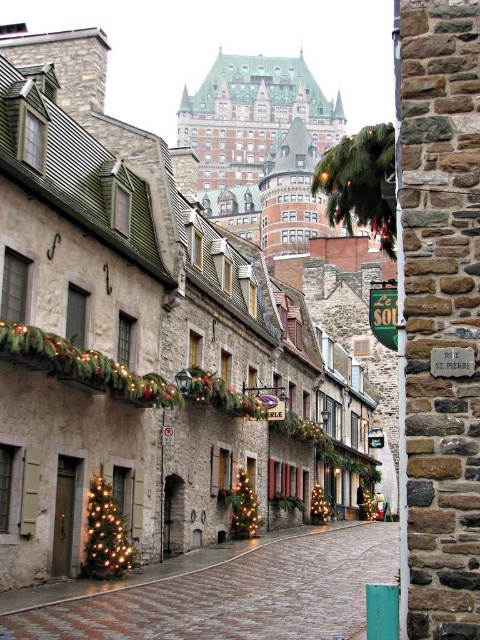
You are standing at the entrance of the street and want to take a photo of the stone building at center. Which direction should you face to ensure it is in the frame?

The stone building at center is located at point coordinates of (163, 330), so you should face towards the center of the image to capture it in your photo.

You are a tourist standing on the cobblestone street in the historic town. You want to take a photo of the iridescent glass christmas tree at lower left and the stone building at center. Which object should you focus on first if you want to capture both in one frame without moving your camera?

The stone building at center is bigger than the iridescent glass christmas tree at lower left, so you should focus on the stone building at center first to ensure it fits properly in the frame before adjusting for the smaller tree.